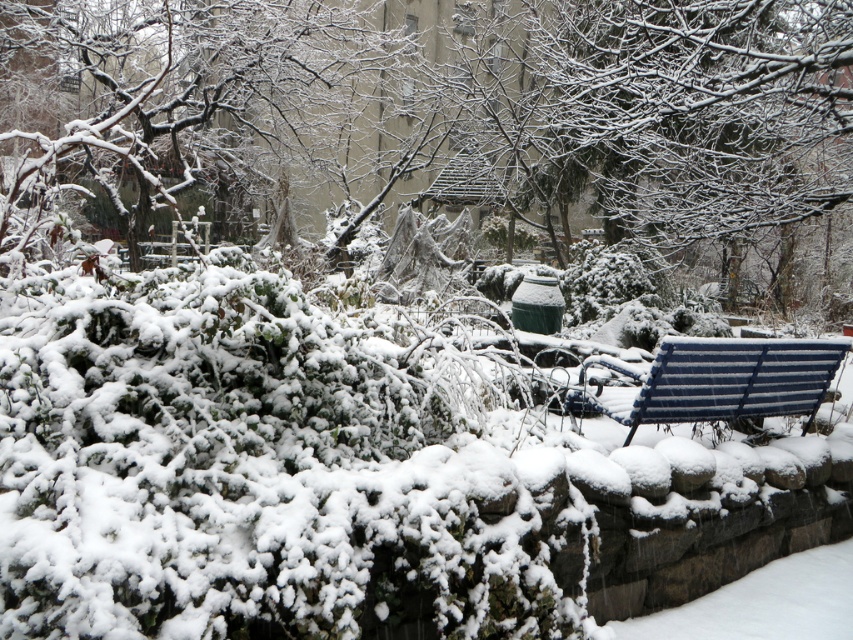
Question: Is snow-covered branches at upper left further to the viewer compared to blue striped bench at right?

Choices:
 (A) yes
 (B) no

Answer: (B)

Question: Among these objects, which one is farthest from the camera?

Choices:
 (A) snow-covered branches at upper left
 (B) blue striped bench at right

Answer: (B)

Question: Can you confirm if snow-covered branches at upper left is positioned to the right of blue striped bench at right?

Choices:
 (A) no
 (B) yes

Answer: (A)

Question: Is snow-covered branches at upper left wider than blue striped bench at right?

Choices:
 (A) yes
 (B) no

Answer: (A)

Question: Which of the following is the farthest from the observer?

Choices:
 (A) (32, 115)
 (B) (766, 404)

Answer: (A)